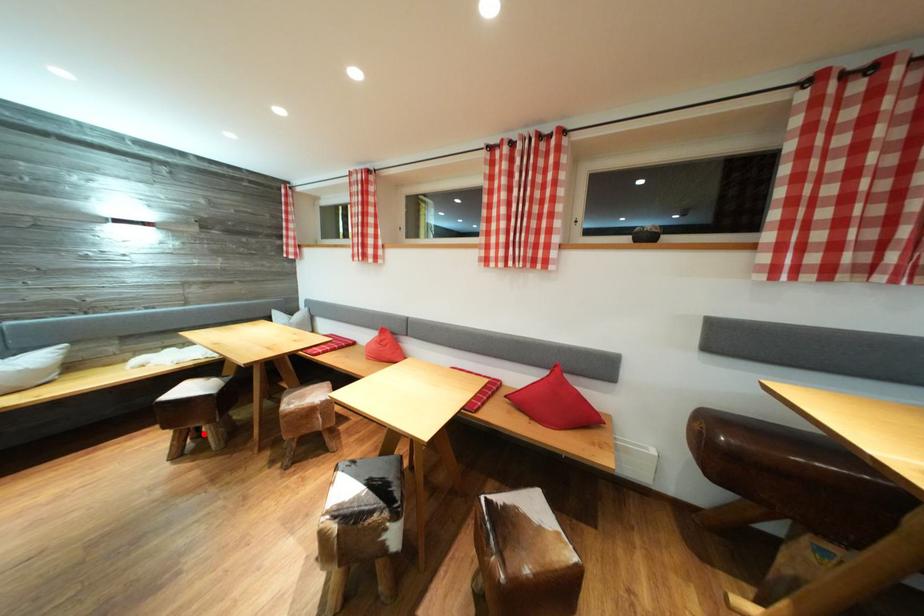
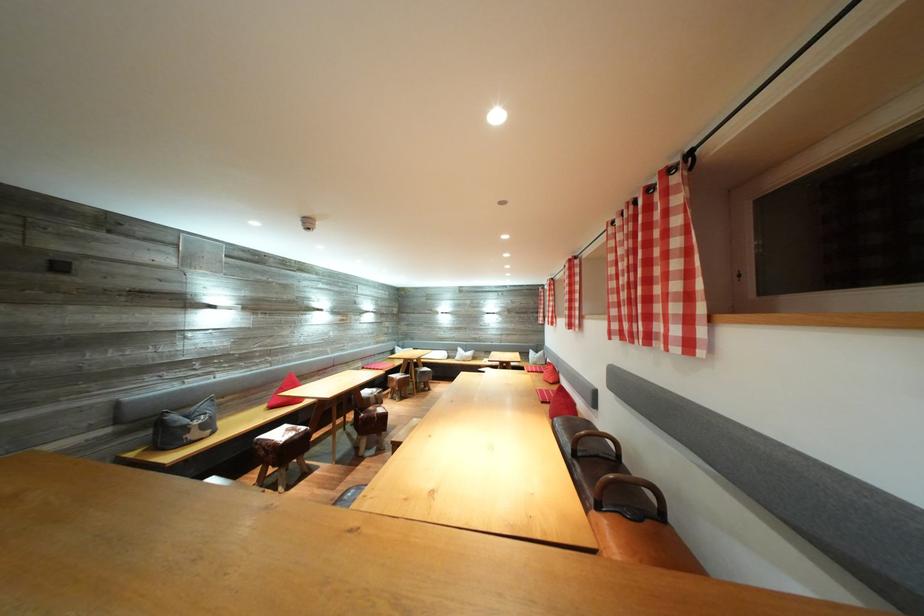
Question: I am providing you with two images of the same scene from different viewpoints. A red point is marked on the first image. Can you still see the location of the red point in image 2?

Choices:
 (A) Yes
 (B) No

Answer: (B)